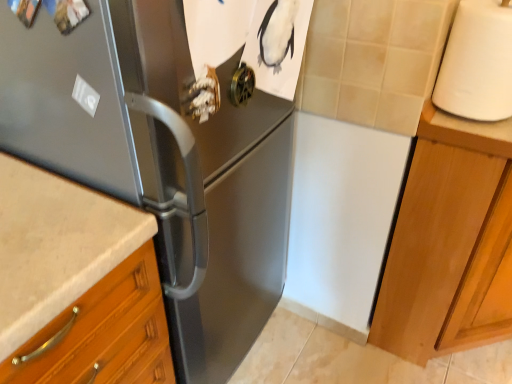
Question: From their relative heights in the image, would you say white matte paper towel at right is taller or shorter than white matte countertop at right?

Choices:
 (A) tall
 (B) short

Answer: (A)

Question: Considering the positions of white matte paper towel at right and white matte countertop at right in the image, is white matte paper towel at right bigger or smaller than white matte countertop at right?

Choices:
 (A) big
 (B) small

Answer: (A)

Question: Which object is positioned closest to the light wood cabinet at right?

Choices:
 (A) satin black refrigerator at left
 (B) white matte paper towel at right
 (C) white matte countertop at right

Answer: (B)

Question: Which object is positioned farthest from the white matte countertop at right?

Choices:
 (A) satin black refrigerator at left
 (B) white matte paper towel at right
 (C) light wood cabinet at right

Answer: (A)